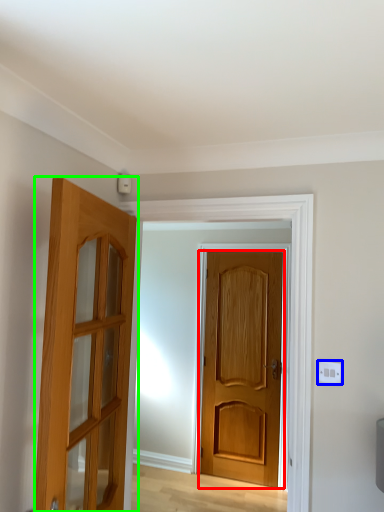
Question: Based on their relative distances, which object is farther from door (highlighted by a red box)? Choose from electric outlet (highlighted by a blue box) and door (highlighted by a green box).

Choices:
 (A) electric outlet
 (B) door

Answer: (B)